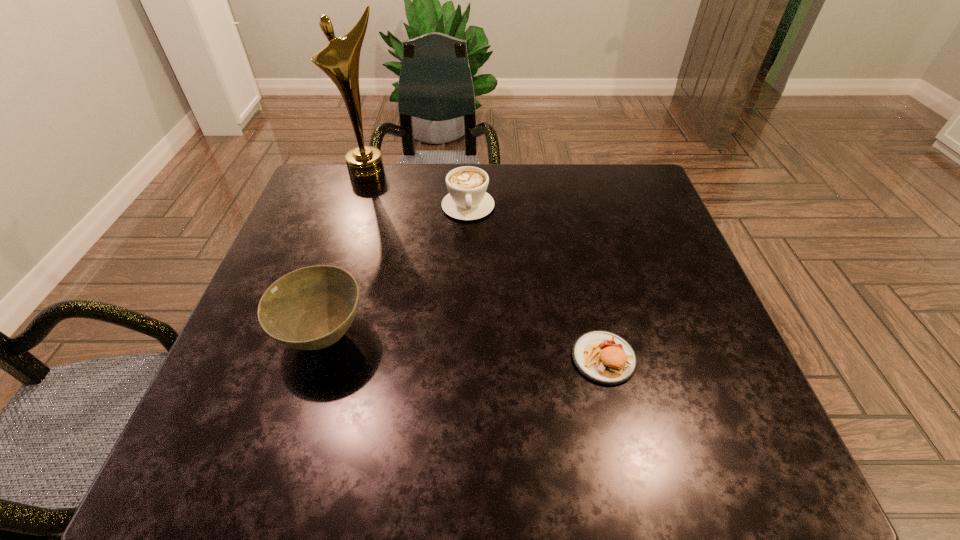
The width and height of the screenshot is (960, 540). Identify the location of object that is the third closest to the cappuccino. coord(604,357).

Identify which object is the closest to the award. Please provide its 2D coordinates. Your answer should be formatted as a tuple, i.e. [(x, y)], where the tuple contains the x and y coordinates of a point satisfying the conditions above.

[(467, 200)]

In order to click on vacant point that satisfies the following two spatial constraints: 1. on the front side of the tallest object; 2. on the right side of the second farthest object in this screenshot , I will do `click(358, 206)`.